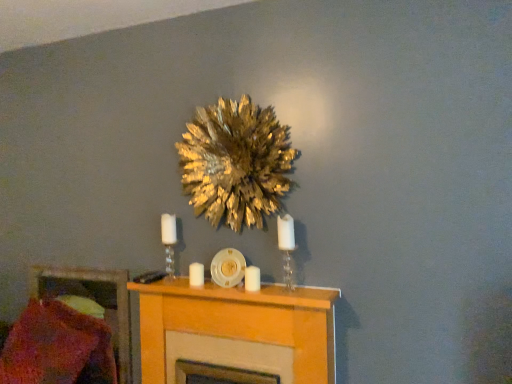
Question: Is light wood fireplace at center oriented towards white matte candle at center, acting as the second candle starting from the back?

Choices:
 (A) no
 (B) yes

Answer: (A)

Question: Is light wood fireplace at center positioned beyond the bounds of white matte candle at center, the first candle from the front?

Choices:
 (A) no
 (B) yes

Answer: (B)

Question: From a real-world perspective, is light wood fireplace at center on top of white matte candle at center, acting as the second candle starting from the back?

Choices:
 (A) yes
 (B) no

Answer: (B)

Question: Are light wood fireplace at center and white matte candle at center, marked as the 2th candle in a left-to-right arrangement, far apart?

Choices:
 (A) yes
 (B) no

Answer: (B)

Question: Is light wood fireplace at center directly adjacent to white matte candle at center, acting as the second candle starting from the back?

Choices:
 (A) yes
 (B) no

Answer: (B)

Question: Considering the positions of white matte candle at center, acting as the 2th candle starting from the right, and light wood fireplace at center in the image, is white matte candle at center, acting as the 2th candle starting from the right, bigger or smaller than light wood fireplace at center?

Choices:
 (A) big
 (B) small

Answer: (B)

Question: Is point (202, 264) closer or farther from the camera than point (206, 299)?

Choices:
 (A) farther
 (B) closer

Answer: (A)

Question: From the image's perspective, is white matte candle at center, placed as the 2th candle when sorted from front to back, located above or below light wood fireplace at center?

Choices:
 (A) above
 (B) below

Answer: (A)

Question: Considering the positions of white matte candle at center, arranged as the first candle when viewed from the back, and light wood fireplace at center in the image, is white matte candle at center, arranged as the first candle when viewed from the back, wider or thinner than light wood fireplace at center?

Choices:
 (A) thin
 (B) wide

Answer: (A)

Question: Based on their positions, is white matte candle at center, acting as the second candle starting from the back, located to the left or right of white matte candle at center, arranged as the first candle when viewed from the back?

Choices:
 (A) right
 (B) left

Answer: (A)

Question: Is white matte candle at center, which is the first candle from right to left, in front of or behind white matte candle at center, arranged as the first candle when viewed from the back, in the image?

Choices:
 (A) behind
 (B) front

Answer: (B)

Question: Considering the positions of white matte candle at center, which is the first candle from right to left, and white matte candle at center, placed as the 2th candle when sorted from front to back, in the image, is white matte candle at center, which is the first candle from right to left, taller or shorter than white matte candle at center, placed as the 2th candle when sorted from front to back,?

Choices:
 (A) short
 (B) tall

Answer: (B)

Question: From the image's perspective, is white matte candle at center, acting as the second candle starting from the back, positioned above or below white matte candle at center, placed as the 2th candle when sorted from front to back?

Choices:
 (A) above
 (B) below

Answer: (A)

Question: Is white glass candle holder at center, positioned as the first candle holder in left-to-right order, wider or thinner than knitted wool pillow at lower left?

Choices:
 (A) wide
 (B) thin

Answer: (B)

Question: Based on their sizes in the image, would you say white glass candle holder at center, the 2th candle holder viewed from the front, is bigger or smaller than knitted wool pillow at lower left?

Choices:
 (A) big
 (B) small

Answer: (B)